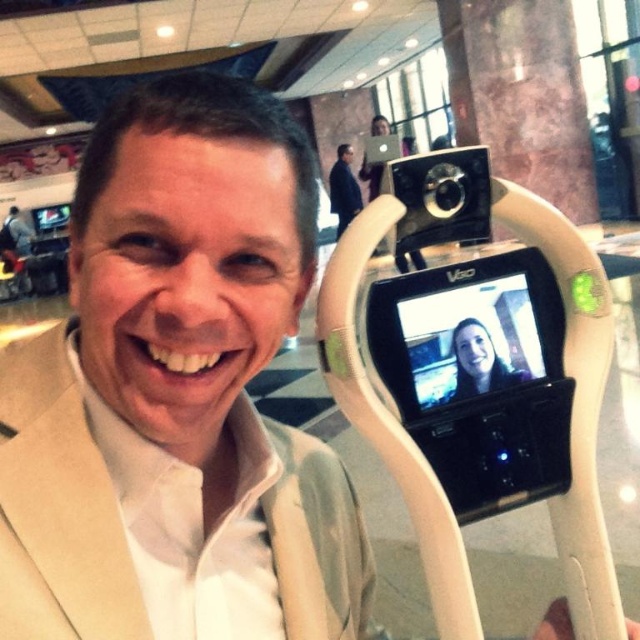
Question: Which object appears farthest from the camera in this image?

Choices:
 (A) black matte suit at upper center
 (B) black plastic camera at upper center

Answer: (A)

Question: Does black plastic camera at upper center appear under black matte suit at upper center?

Choices:
 (A) yes
 (B) no

Answer: (A)

Question: Which point is closer to the camera?

Choices:
 (A) tap(451, 230)
 (B) tap(342, 172)

Answer: (A)

Question: Can you confirm if black plastic camera at upper center is thinner than black matte suit at upper center?

Choices:
 (A) no
 (B) yes

Answer: (B)

Question: Can you confirm if black plastic camera at upper center is positioned below black matte suit at upper center?

Choices:
 (A) yes
 (B) no

Answer: (A)